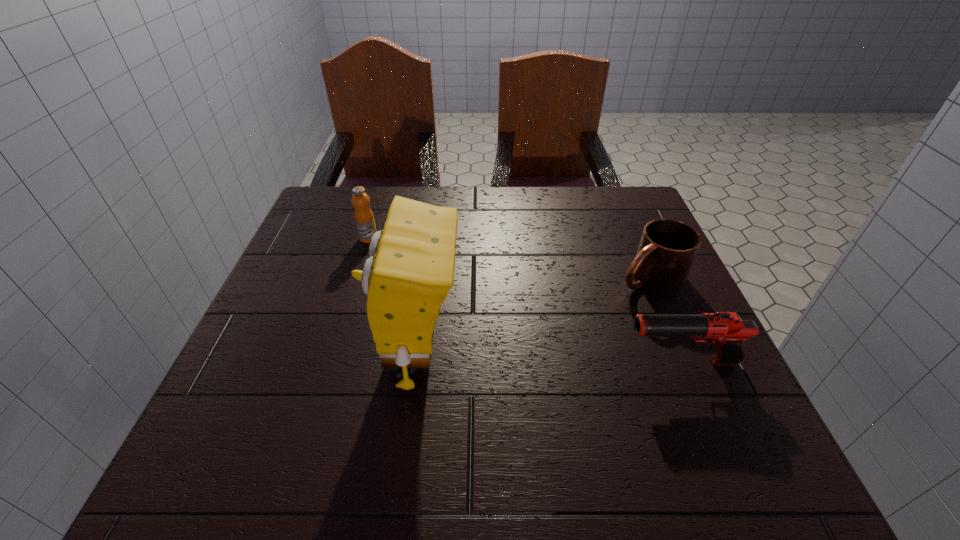
Find the location of a particular element. free location located 0.310m at the aiming end of the gun is located at coordinates 458,363.

I want to click on vacant area situated on the side of the mug with the handle, so click(527, 347).

Where is `free location located 0.250m on the side of the mug with the handle`? Image resolution: width=960 pixels, height=540 pixels. free location located 0.250m on the side of the mug with the handle is located at coordinates (539, 340).

Identify the location of vacant point located on the side of the mug with the handle. This screenshot has width=960, height=540. (519, 352).

This screenshot has width=960, height=540. Find the location of `vacant space located 0.190m on the front label of the leftmost object`. vacant space located 0.190m on the front label of the leftmost object is located at coordinates (420, 280).

This screenshot has width=960, height=540. I want to click on vacant space located on the front label of the leftmost object, so pos(447,304).

At what (x,y) coordinates should I click in order to perform the action: click on vacant region located on the front label of the leftmost object. Please return your answer as a coordinate pair (x, y). Looking at the image, I should click on (417, 278).

Where is `object at the far edge`? The image size is (960, 540). object at the far edge is located at coordinates (364, 218).

Where is `object that is positioned at the near edge`? object that is positioned at the near edge is located at coordinates (410, 271).

Identify the location of object situated at the left edge. (364, 218).